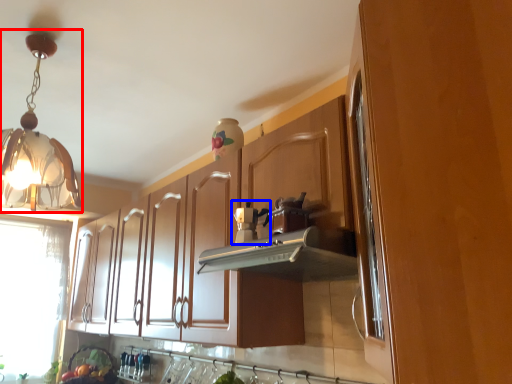
Question: Which point is closer to the camera, lamp (highlighted by a red box) or coffee machine (highlighted by a blue box)?

Choices:
 (A) lamp
 (B) coffee machine

Answer: (A)